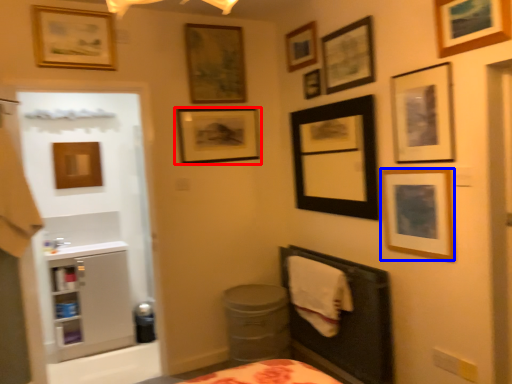
Question: Among these objects, which one is farthest to the camera, picture frame (highlighted by a red box) or picture frame (highlighted by a blue box)?

Choices:
 (A) picture frame
 (B) picture frame

Answer: (A)